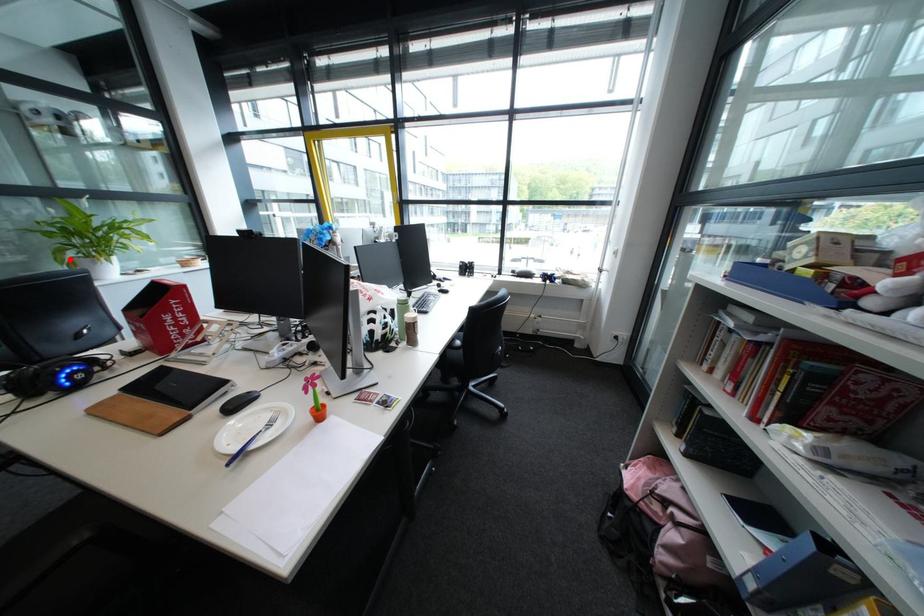
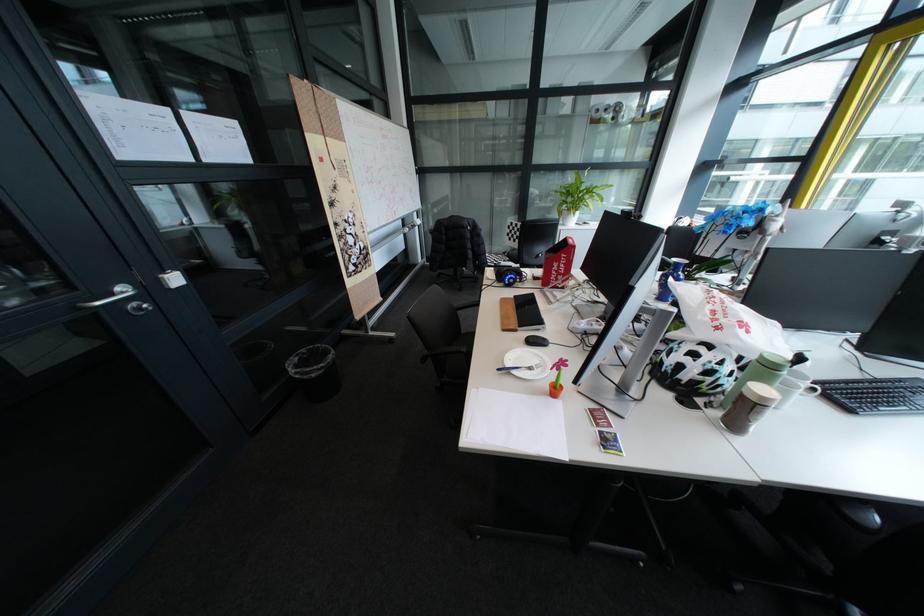
Question: I am providing you with two images of the same scene from different viewpoints. In image1, a red point is highlighted. Considering the same 3D point in image2, which of the following is correct?

Choices:
 (A) It is closer
 (B) It is farther

Answer: (A)